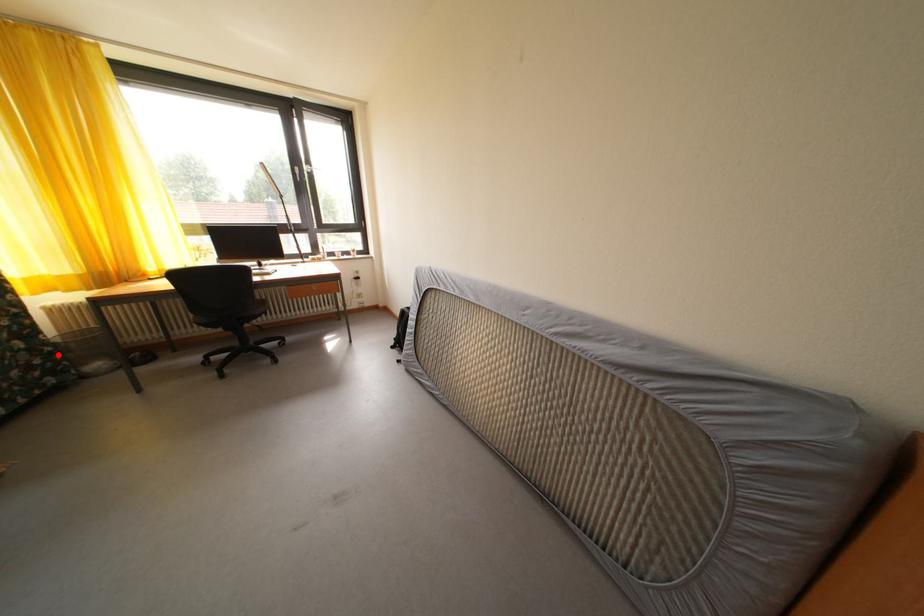
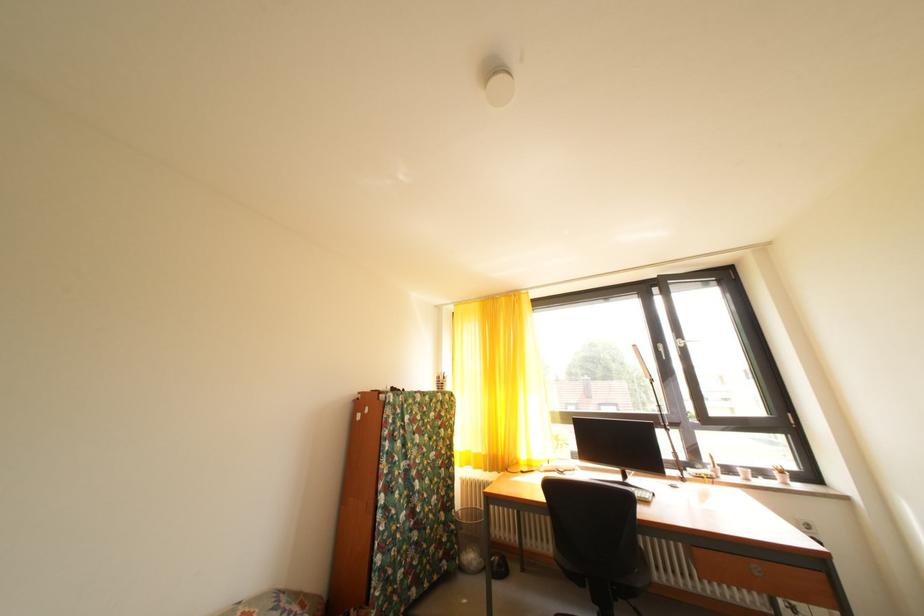
Question: I am providing you with two images of the same scene from different viewpoints. Image1 has a red point marked. In image2, the corresponding 3D location appears at what relative position? Reply with the corresponding letter.

Choices:
 (A) Closer
 (B) Farther

Answer: (A)